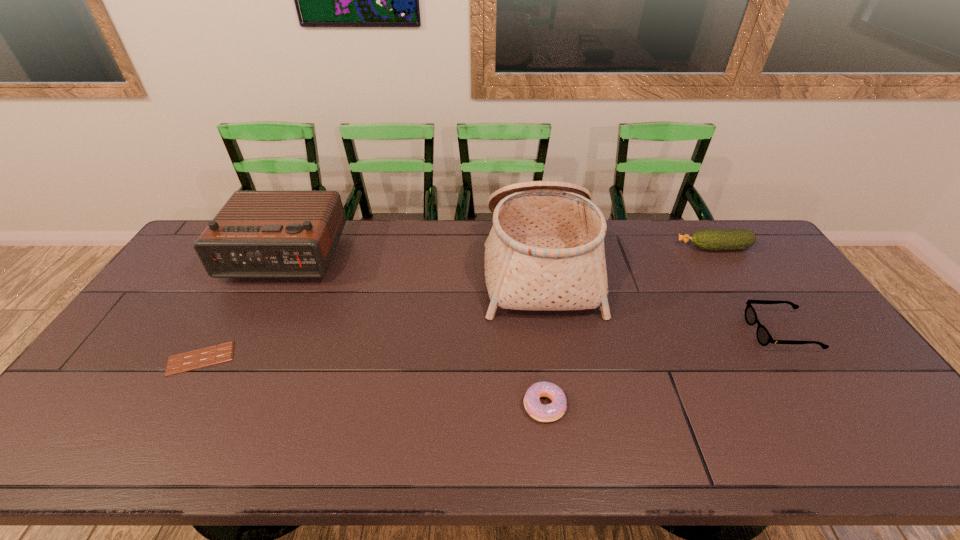
You are a GUI agent. You are given a task and a screenshot of the screen. Output one action in this format:
    pyautogui.click(x=<x>, y=<y>)
    Task: Click on the radio receiver that is at the far edge
    This screenshot has width=960, height=540.
    Given the screenshot: What is the action you would take?
    pyautogui.click(x=257, y=234)

In order to click on cucumber at the far edge in this screenshot , I will do `click(736, 239)`.

Find the location of a particular element. radio receiver that is at the left edge is located at coordinates coord(257,234).

Locate an element on the screen. This screenshot has height=540, width=960. chocolate bar situated at the left edge is located at coordinates (195, 359).

Image resolution: width=960 pixels, height=540 pixels. Find the location of `cucumber at the right edge`. cucumber at the right edge is located at coordinates (736, 239).

Image resolution: width=960 pixels, height=540 pixels. I want to click on spectacles present at the right edge, so click(764, 338).

Locate an element on the screen. object present at the far left corner is located at coordinates (257, 234).

Identify the location of object located in the far right corner section of the desktop. (736, 239).

In the image, there is a desktop. Find the location of `vacant space at the far edge`. vacant space at the far edge is located at coordinates point(628,225).

Identify the location of free space at the near edge of the desktop. (398, 449).